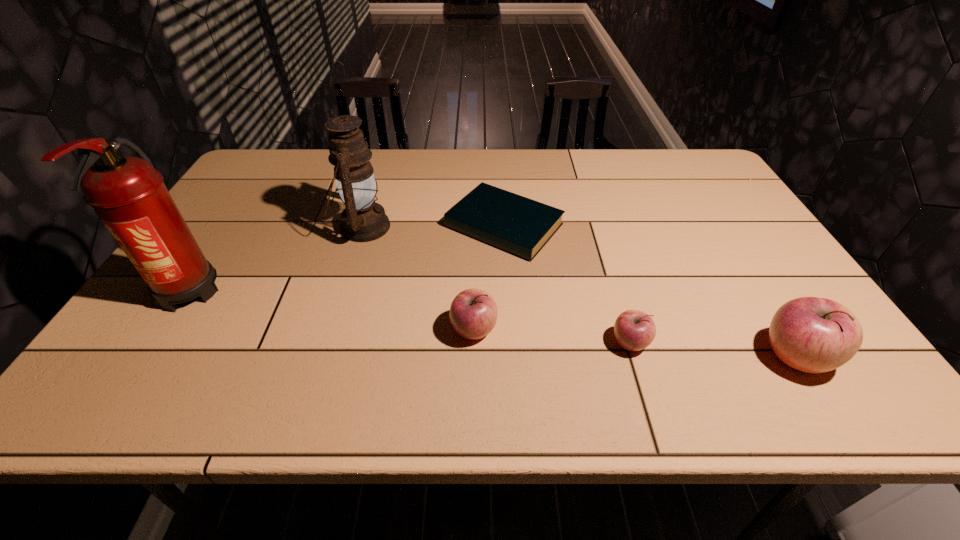
Locate which object ranks second in proximity to the fifth object from left to right. Please provide its 2D coordinates. Your answer should be formatted as a tuple, i.e. [(x, y)], where the tuple contains the x and y coordinates of a point satisfying the conditions above.

[(519, 225)]

Choose which object is the third nearest neighbor to the leftmost apple. Please provide its 2D coordinates. Your answer should be formatted as a tuple, i.e. [(x, y)], where the tuple contains the x and y coordinates of a point satisfying the conditions above.

[(363, 220)]

Identify which apple is located as the second nearest to the tallest apple. Please provide its 2D coordinates. Your answer should be formatted as a tuple, i.e. [(x, y)], where the tuple contains the x and y coordinates of a point satisfying the conditions above.

[(473, 313)]

Locate which apple ranks in proximity to the tallest apple. Please provide its 2D coordinates. Your answer should be formatted as a tuple, i.e. [(x, y)], where the tuple contains the x and y coordinates of a point satisfying the conditions above.

[(634, 330)]

The image size is (960, 540). In order to click on free region that satisfies the following two spatial constraints: 1. on the front side of the leftmost apple; 2. on the left side of the oil lamp in this screenshot , I will do `click(330, 330)`.

The height and width of the screenshot is (540, 960). Find the location of `vacant region that satisfies the following two spatial constraints: 1. on the back side of the fourth tallest object; 2. on the right side of the book`. vacant region that satisfies the following two spatial constraints: 1. on the back side of the fourth tallest object; 2. on the right side of the book is located at coordinates (475, 226).

Locate an element on the screen. Image resolution: width=960 pixels, height=540 pixels. blank area in the image that satisfies the following two spatial constraints: 1. on the front-facing side of the tallest apple; 2. on the left side of the tallest object is located at coordinates [145, 357].

This screenshot has height=540, width=960. Find the location of `vacant space that satisfies the following two spatial constraints: 1. on the front side of the second tallest object; 2. on the right side of the second object from right to left`. vacant space that satisfies the following two spatial constraints: 1. on the front side of the second tallest object; 2. on the right side of the second object from right to left is located at coordinates (326, 343).